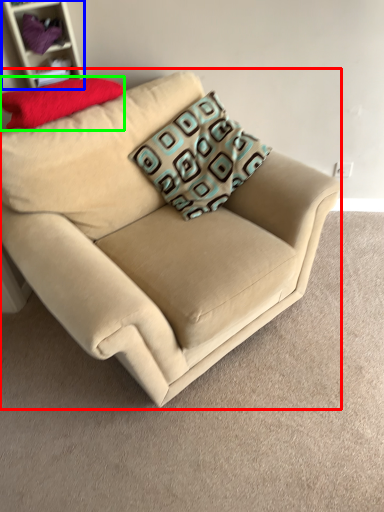
Question: Based on their relative distances, which object is nearer to studio couch (highlighted by a red box)? Choose from shelf (highlighted by a blue box) and pillow (highlighted by a green box).

Choices:
 (A) shelf
 (B) pillow

Answer: (B)